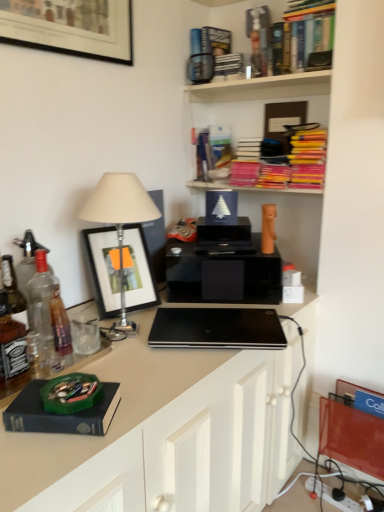
The height and width of the screenshot is (512, 384). I want to click on empty space that is ontop of black matte laptop at center (from a real-world perspective), so pos(215,324).